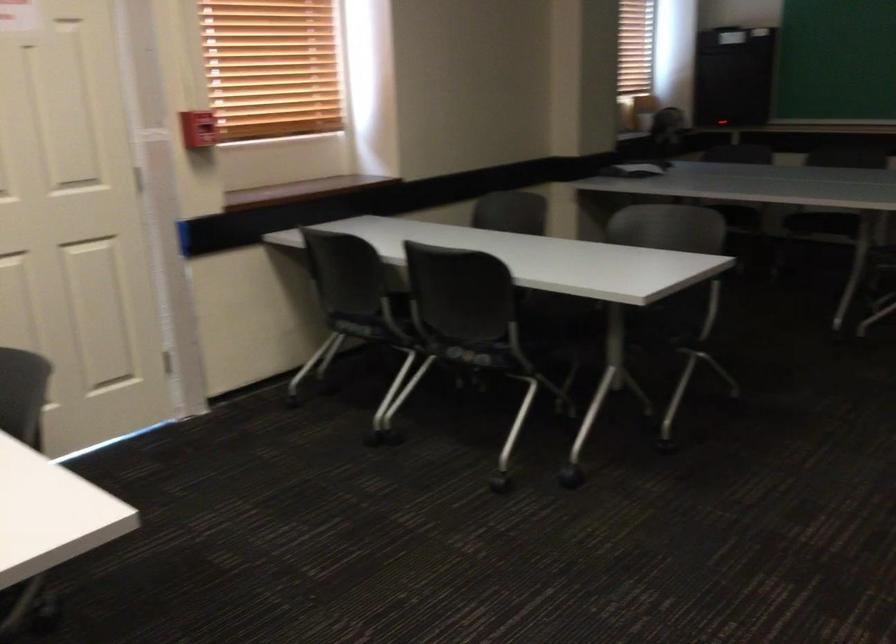
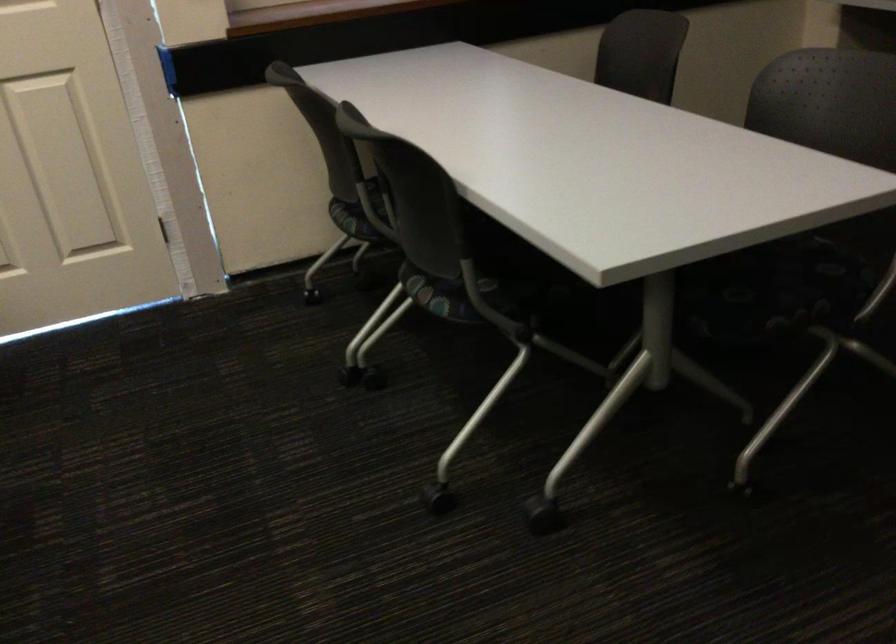
In a continuous first-person perspective shot, in which direction is the camera moving?

The movement direction of the cameraman is right, forward.